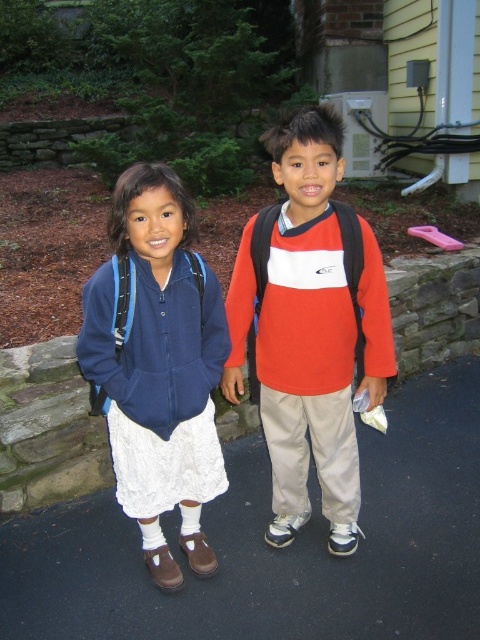
You are standing in front of a house where two children are playing. You see a point marked at coordinates [310,332]. What object is located at that point?

The point at coordinates [310,332] marks the location of the matte red sweater at center.

You are a delivery drone trying to land on the black asphalt pavement at lower center. However, you notice the matte blue backpack at left is nearby. Based on their heights, will the backpack block your landing path?

The black asphalt pavement at lower center is not as tall as the matte blue backpack at left. Since the backpack is taller, it might block the drone from landing safely on the pavement.